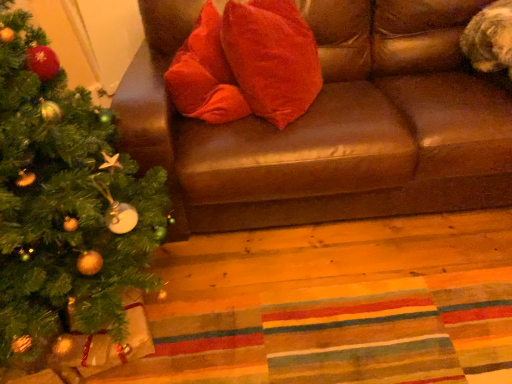
Question: Is velvet red pillow at center wider or thinner than brown leather couch at upper center?

Choices:
 (A) thin
 (B) wide

Answer: (A)

Question: In terms of size, does velvet red pillow at center appear bigger or smaller than brown leather couch at upper center?

Choices:
 (A) big
 (B) small

Answer: (B)

Question: Considering the real-world distances, which object is farthest from the brown leather couch at upper center?

Choices:
 (A) green matte christmas tree at left
 (B) velvet red pillow at center

Answer: (A)

Question: Considering the real-world distances, which object is closest to the velvet red pillow at center?

Choices:
 (A) green matte christmas tree at left
 (B) brown leather couch at upper center

Answer: (B)